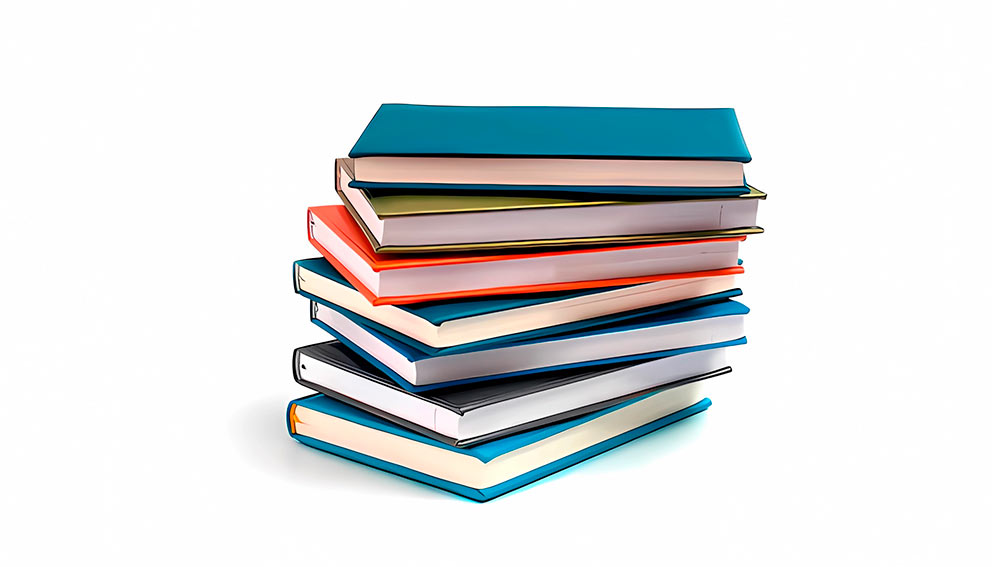
Where is `hardcover books`? This screenshot has height=567, width=992. hardcover books is located at coordinates (517, 168), (498, 218), (503, 269), (512, 311), (549, 352), (530, 400), (547, 447).